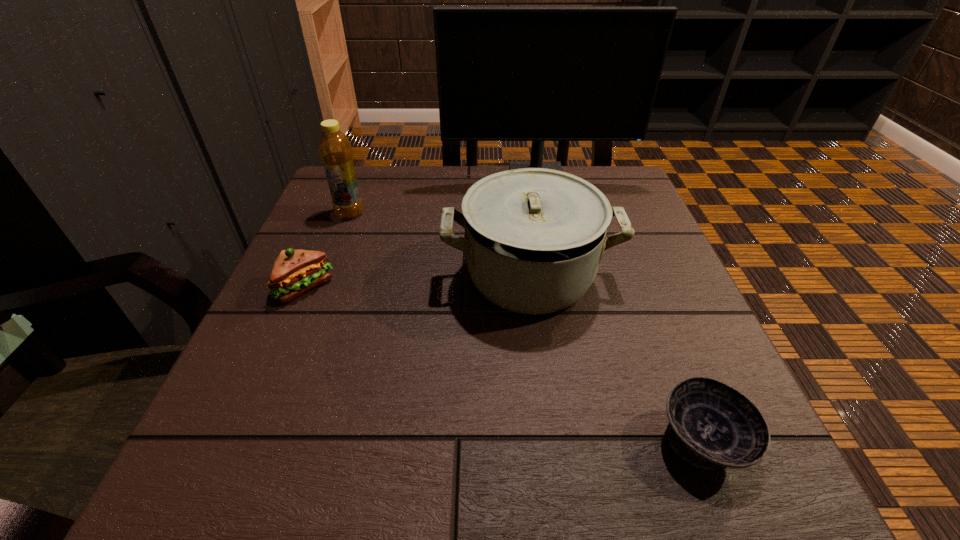
Where is `free area in between the nearest object and the fourth shortest object`? This screenshot has height=540, width=960. free area in between the nearest object and the fourth shortest object is located at coordinates (526, 327).

What are the coordinates of `free point between the sandwich and the bottle` in the screenshot? It's located at (327, 251).

At what (x,y) coordinates should I click in order to perform the action: click on vacant area that lies between the shortest object and the bottle. Please return your answer as a coordinate pair (x, y). Looking at the image, I should click on (526, 327).

The image size is (960, 540). In order to click on free space between the second farthest object and the third tallest object in this screenshot , I will do `click(440, 245)`.

Where is `vacant point located between the saucepan and the second tallest object`? The width and height of the screenshot is (960, 540). vacant point located between the saucepan and the second tallest object is located at coordinates (440, 245).

Locate an element on the screen. The image size is (960, 540). vacant space in between the second farthest object and the computer monitor is located at coordinates (444, 195).

Locate an element on the screen. The width and height of the screenshot is (960, 540). unoccupied position between the sandwich and the third tallest object is located at coordinates (418, 282).

Identify the location of vacant area that lies between the farthest object and the sandwich. The height and width of the screenshot is (540, 960). (420, 233).

Locate an element on the screen. The height and width of the screenshot is (540, 960). object that stands as the third closest to the fourth shortest object is located at coordinates (534, 237).

Choose which object is the third nearest neighbor to the fourth tallest object. Please provide its 2D coordinates. Your answer should be formatted as a tuple, i.e. [(x, y)], where the tuple contains the x and y coordinates of a point satisfying the conditions above.

[(538, 74)]